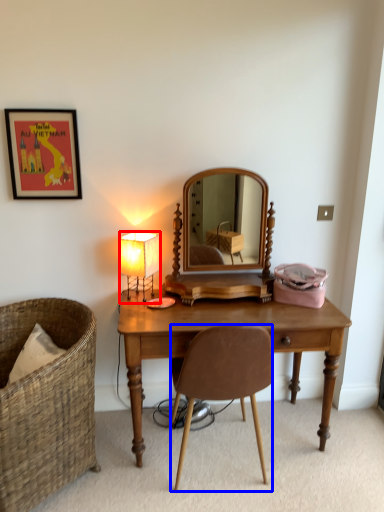
Question: Which object is closer to the camera taking this photo, lamp (highlighted by a red box) or chair (highlighted by a blue box)?

Choices:
 (A) lamp
 (B) chair

Answer: (B)